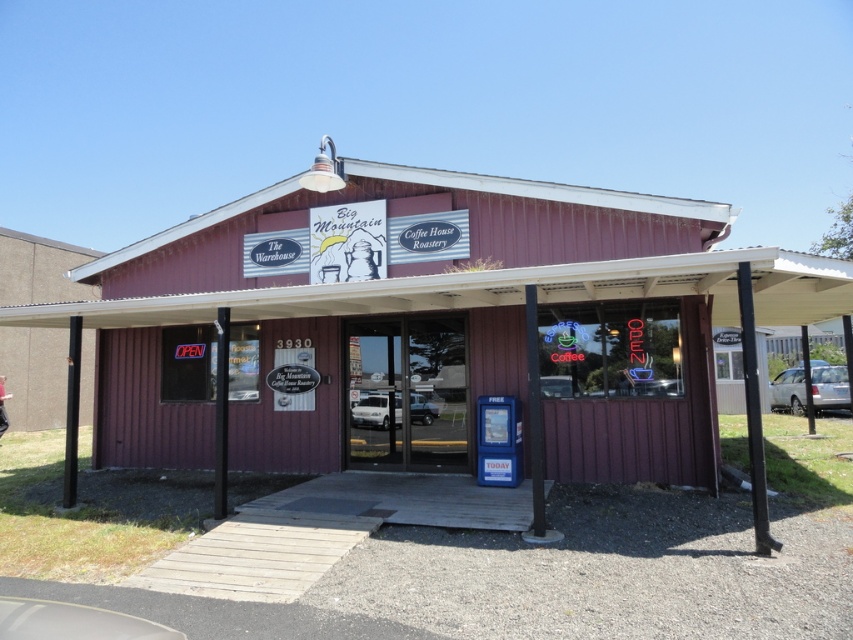
Who is more distant from viewer, (120, 317) or (846, 385)?

Positioned behind is point (846, 385).

Does wooden paneling at center have a greater height compared to satin silver sedan at right?

Correct, wooden paneling at center is much taller as satin silver sedan at right.

Describe the element at coordinates (434, 330) in the screenshot. The width and height of the screenshot is (853, 640). I see `wooden paneling at center` at that location.

At what (x,y) coordinates should I click in order to perform the action: click on wooden paneling at center. Please return your answer as a coordinate pair (x, y). Image resolution: width=853 pixels, height=640 pixels. Looking at the image, I should click on (x=434, y=330).

Does satin silver sedan at right have a greater width compared to white matte van at center?

Yes, satin silver sedan at right is wider than white matte van at center.

Between point (813, 406) and point (419, 413), which one is positioned behind?

Positioned behind is point (813, 406).

Image resolution: width=853 pixels, height=640 pixels. I want to click on satin silver sedan at right, so (828, 387).

Does wooden paneling at center have a greater width compared to white matte car at center?

Yes, wooden paneling at center is wider than white matte car at center.

Is point (461, 214) in front of point (422, 419)?

Yes, it is in front of point (422, 419).

Find the location of a particular element. This screenshot has height=640, width=853. wooden paneling at center is located at coordinates (434, 330).